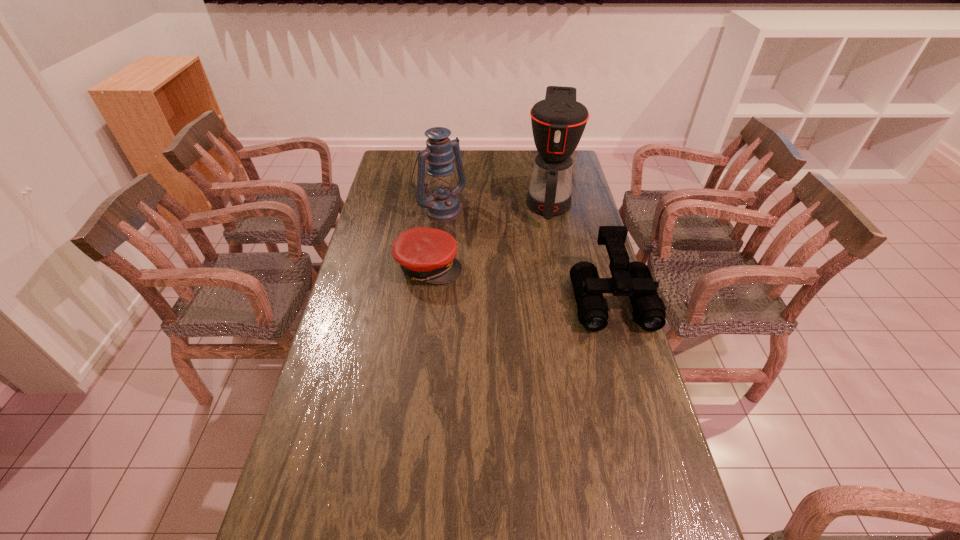
Image resolution: width=960 pixels, height=540 pixels. I want to click on empty location between the coffee maker and the shortest object, so click(489, 234).

This screenshot has height=540, width=960. Find the location of `empty space that is in between the coffee maker and the lantern`. empty space that is in between the coffee maker and the lantern is located at coordinates pos(494,204).

Identify the location of free space between the coffee maker and the shortest object. (489, 234).

Where is `vacant area that lies between the lantern and the binoculars`? The height and width of the screenshot is (540, 960). vacant area that lies between the lantern and the binoculars is located at coordinates (526, 253).

The image size is (960, 540). Identify the location of object that is the second closest one to the second shortest object. (425, 254).

Identify which object is the third closest to the coffee maker. Please provide its 2D coordinates. Your answer should be formatted as a tuple, i.e. [(x, y)], where the tuple contains the x and y coordinates of a point satisfying the conditions above.

[(425, 254)]